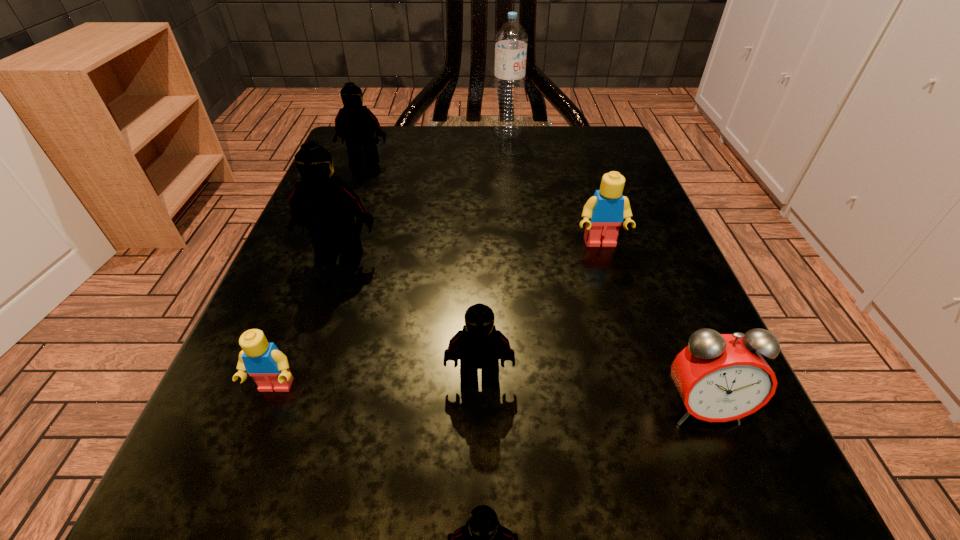
Identify which Lego is the nearest to the tallest Lego. Please provide its 2D coordinates. Your answer should be formatted as a tuple, i.e. [(x, y)], where the tuple contains the x and y coordinates of a point satisfying the conditions above.

[(264, 362)]

Identify which black Lego is the second nearest to the tallest object. Please provide its 2D coordinates. Your answer should be formatted as a tuple, i.e. [(x, y)], where the tuple contains the x and y coordinates of a point satisfying the conditions above.

[(324, 204)]

Identify which black Lego is the second closest to the rightmost Lego. Please provide its 2D coordinates. Your answer should be formatted as a tuple, i.e. [(x, y)], where the tuple contains the x and y coordinates of a point satisfying the conditions above.

[(324, 204)]